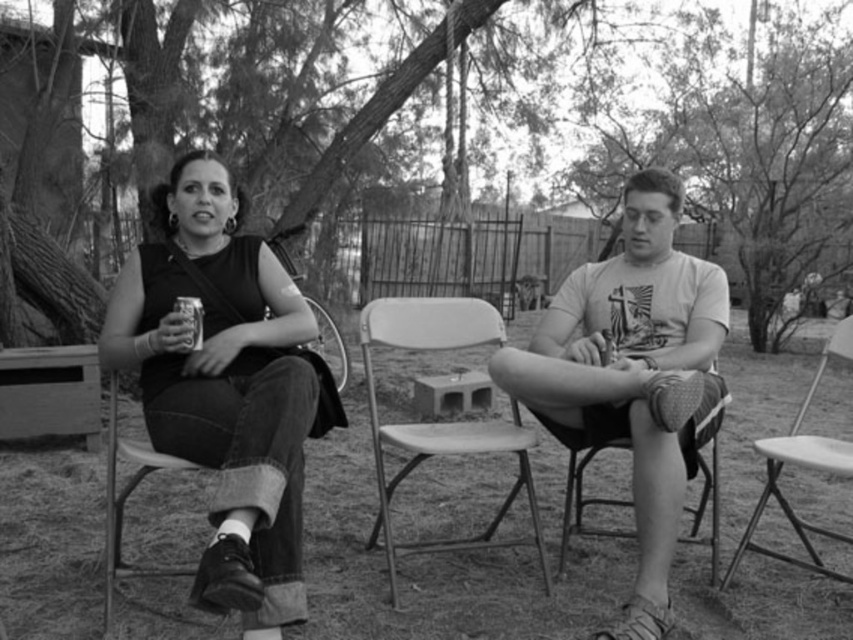
Question: Based on their relative distances, which object is nearer to the smooth plastic chair at center?

Choices:
 (A) metallic silver can at center
 (B) matte black tank top at left
 (C) metallic folding chair at center
 (D) smooth bark tree at center

Answer: (C)

Question: Can you confirm if matte black tank top at left is thinner than smooth plastic chair at center?

Choices:
 (A) no
 (B) yes

Answer: (B)

Question: Is matte white t-shirt at center positioned before smooth plastic chair at center?

Choices:
 (A) no
 (B) yes

Answer: (B)

Question: Which object is the farthest from the metallic folding chair at center?

Choices:
 (A) smooth bark tree trunk at upper left
 (B) metallic silver can at center
 (C) matte black tank top at left
 (D) matte white t-shirt at center

Answer: (A)

Question: Which object is closer to the camera taking this photo?

Choices:
 (A) smooth plastic chair at center
 (B) smooth bark tree trunk at upper left
 (C) metallic silver can at center
 (D) matte white t-shirt at center

Answer: (D)

Question: Is metallic folding chair at right smaller than metallic silver can at center?

Choices:
 (A) yes
 (B) no

Answer: (B)